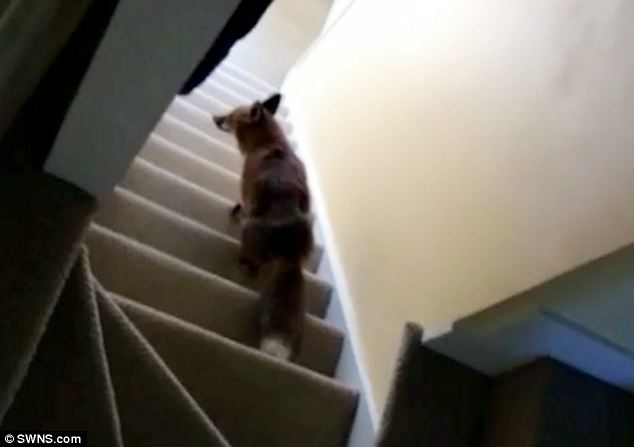
You are a GUI agent. You are given a task and a screenshot of the screen. Output one action in this format:
    pyautogui.click(x=<x>, y=<y>)
    Task: Click on the stairs
    The height and width of the screenshot is (447, 634).
    Given the screenshot: What is the action you would take?
    151,334, 151,261, 170,198